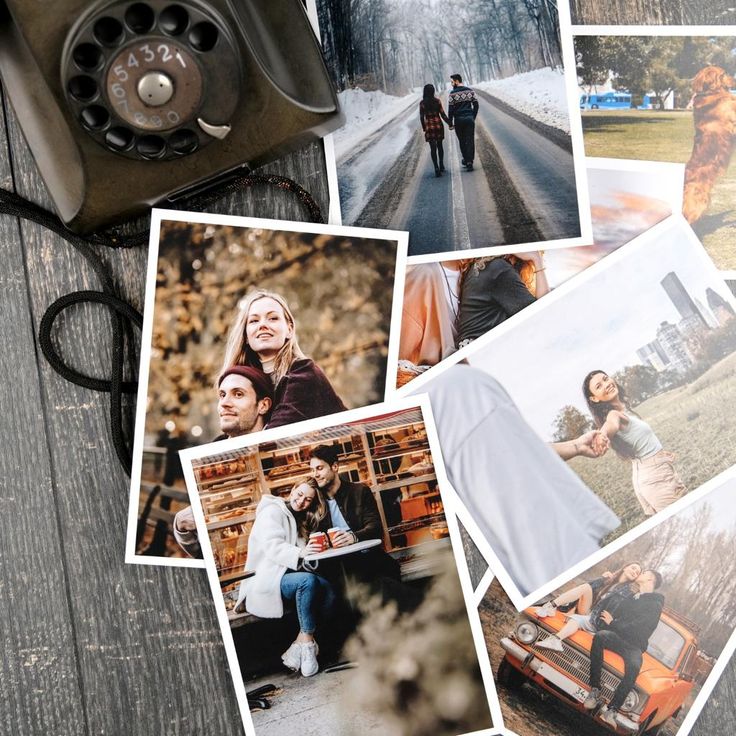
Locate an element on the screen. The image size is (736, 736). photographs is located at coordinates (191, 452), (400, 251), (580, 238), (634, 162), (620, 29), (662, 224), (697, 710).